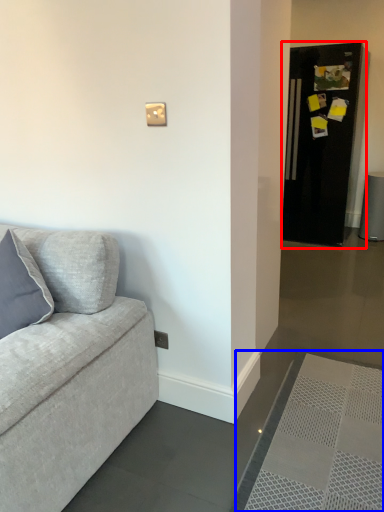
Question: Which object is closer to the camera taking this photo, fridge (highlighted by a red box) or doormat (highlighted by a blue box)?

Choices:
 (A) fridge
 (B) doormat

Answer: (B)